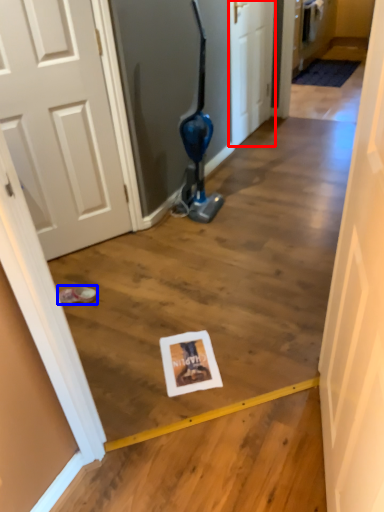
Question: Among these objects, which one is farthest to the camera, door (highlighted by a red box) or footwear (highlighted by a blue box)?

Choices:
 (A) door
 (B) footwear

Answer: (A)